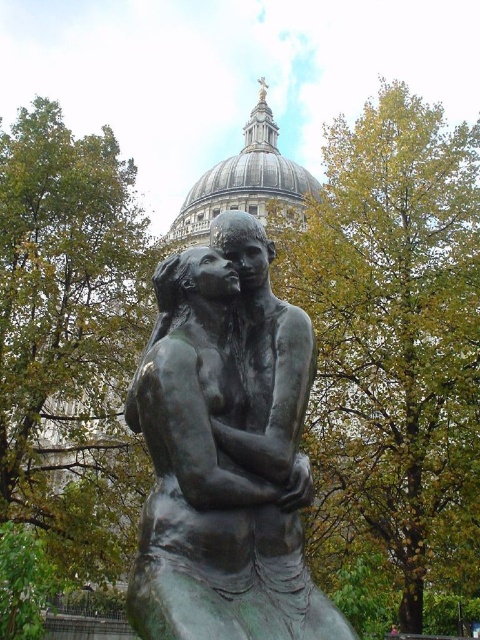
Question: Can you confirm if green leafy tree at center is wider than bronze statue at center?

Choices:
 (A) no
 (B) yes

Answer: (B)

Question: Can you confirm if green leafy tree at center is wider than green leafy tree at left?

Choices:
 (A) no
 (B) yes

Answer: (B)

Question: Estimate the real-world distances between objects in this image. Which object is farther from the gray stone dome at upper center?

Choices:
 (A) green leafy tree at left
 (B) bronze statue at center

Answer: (B)

Question: Which object appears farthest from the camera in this image?

Choices:
 (A) green leafy tree at center
 (B) bronze statue at center
 (C) green leafy tree at left

Answer: (C)

Question: Does bronze statue at center lie in front of green leafy tree at left?

Choices:
 (A) yes
 (B) no

Answer: (A)

Question: Which point appears farthest from the camera in this image?

Choices:
 (A) (3, 500)
 (B) (310, 296)
 (C) (238, 380)
 (D) (172, 232)

Answer: (D)